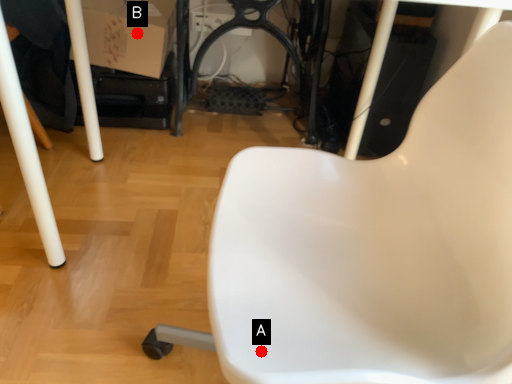
Question: Two points are circled on the image, labeled by A and B beside each circle. Among these points, which one is nearest to the camera?

Choices:
 (A) A is closer
 (B) B is closer

Answer: (A)